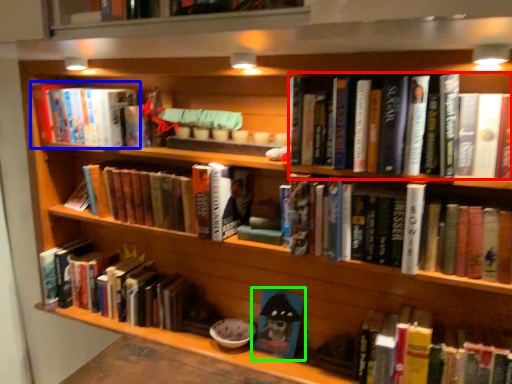
Question: Based on their relative distances, which object is nearer to book (highlighted by a red box)? Choose from book (highlighted by a blue box) and book (highlighted by a green box).

Choices:
 (A) book
 (B) book

Answer: (B)